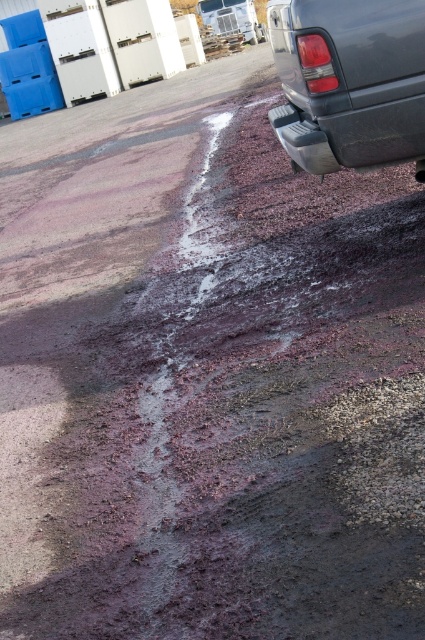
Question: Is brushed metal truck at upper right behind black rubber tire at lower right?

Choices:
 (A) yes
 (B) no

Answer: (A)

Question: Which point appears farthest from the camera in this image?

Choices:
 (A) (249, 42)
 (B) (342, 49)
 (C) (252, 19)

Answer: (C)

Question: Is glossy plastic truck at upper right below black rubber tire at lower right?

Choices:
 (A) yes
 (B) no

Answer: (A)

Question: Which object is closer to the camera taking this photo?

Choices:
 (A) black rubber tire at lower right
 (B) brushed metal truck at upper right

Answer: (A)

Question: Which of these objects is positioned farthest from the glossy plastic truck at upper right?

Choices:
 (A) black rubber tire at lower right
 (B) brushed metal truck at upper right

Answer: (B)

Question: Does glossy plastic truck at upper right appear on the right side of brushed metal truck at upper right?

Choices:
 (A) yes
 (B) no

Answer: (A)